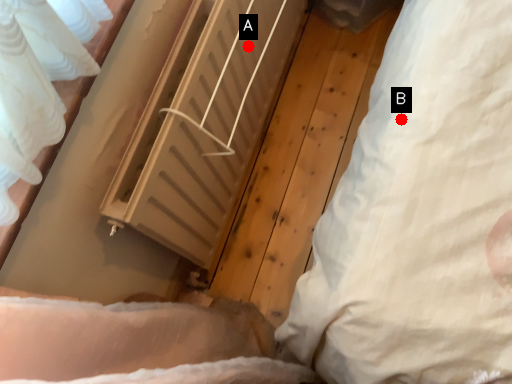
Question: Two points are circled on the image, labeled by A and B beside each circle. Which of the following is the farthest from the observer?

Choices:
 (A) A is further
 (B) B is further

Answer: (A)